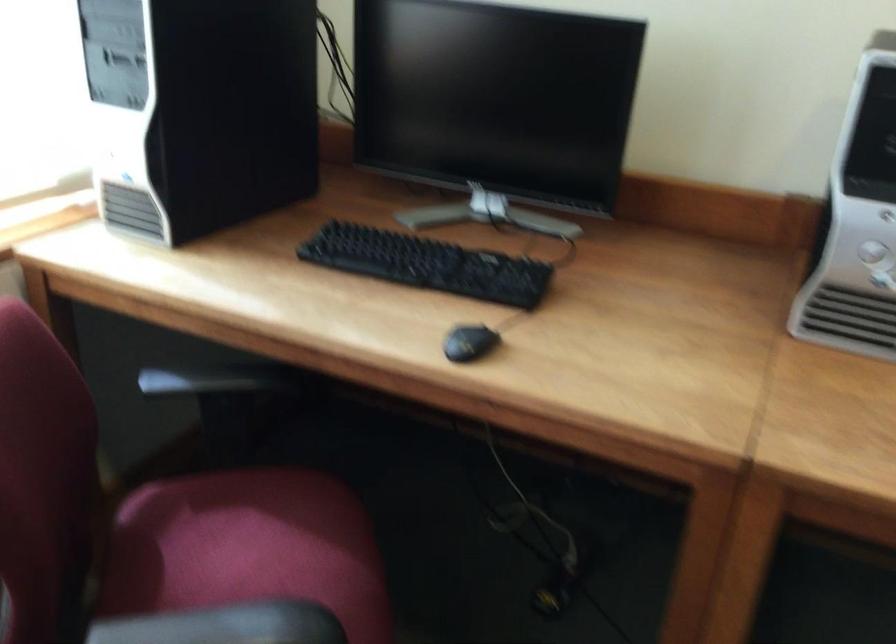
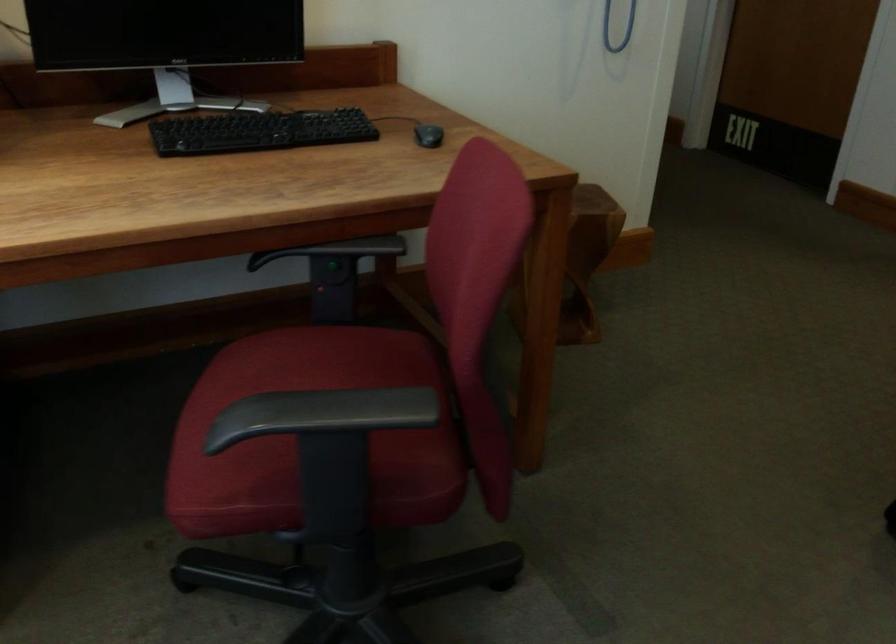
Question: The images are taken continuously from a first-person perspective. In which direction is your viewpoint rotating?

Choices:
 (A) Left
 (B) Right
 (C) Up
 (D) Down

Answer: (B)